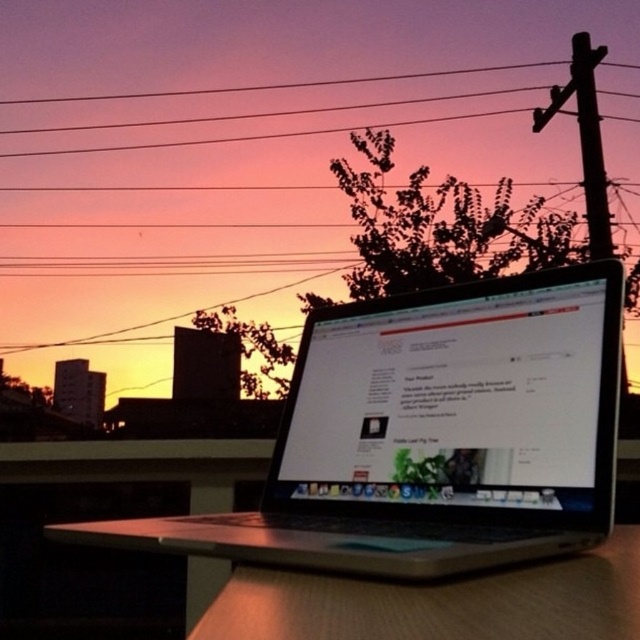
Question: Which object is closer to the camera taking this photo?

Choices:
 (A) silver metallic laptop at center
 (B) satin silver laptop at center

Answer: (A)

Question: Is silver metallic laptop at center bigger than satin silver laptop at center?

Choices:
 (A) yes
 (B) no

Answer: (A)

Question: From the image, what is the correct spatial relationship of silver metallic laptop at center in relation to satin silver laptop at center?

Choices:
 (A) left
 (B) right

Answer: (A)

Question: Is silver metallic laptop at center bigger than satin silver laptop at center?

Choices:
 (A) yes
 (B) no

Answer: (A)

Question: Among these objects, which one is nearest to the camera?

Choices:
 (A) silver metallic laptop at center
 (B) satin silver laptop at center

Answer: (A)